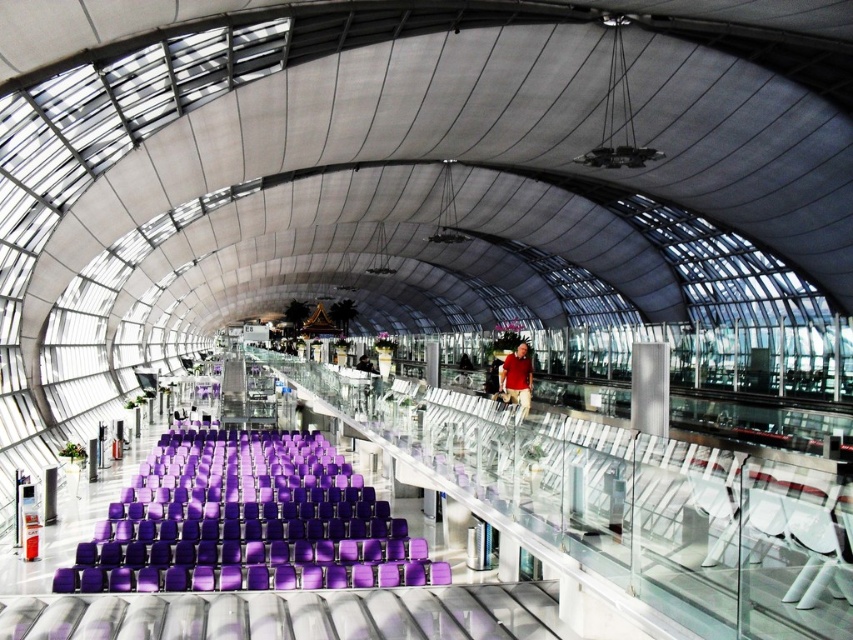
Question: Where is purple fabric chair at center located in relation to red matte shirt at center in the image?

Choices:
 (A) right
 (B) left

Answer: (B)

Question: Is purple fabric chair at center in front of red matte shirt at center?

Choices:
 (A) yes
 (B) no

Answer: (A)

Question: Can you confirm if purple fabric chair at center is wider than matte black shirt at center?

Choices:
 (A) yes
 (B) no

Answer: (A)

Question: Estimate the real-world distances between objects in this image. Which object is closer to the purple fabric chair at center?

Choices:
 (A) red matte shirt at center
 (B) matte black shirt at center

Answer: (A)

Question: Among these points, which one is nearest to the camera?

Choices:
 (A) (531, 380)
 (B) (357, 364)
 (C) (415, 566)

Answer: (C)

Question: Which object is positioned farthest from the purple fabric chair at center?

Choices:
 (A) red matte shirt at center
 (B) matte black shirt at center

Answer: (B)